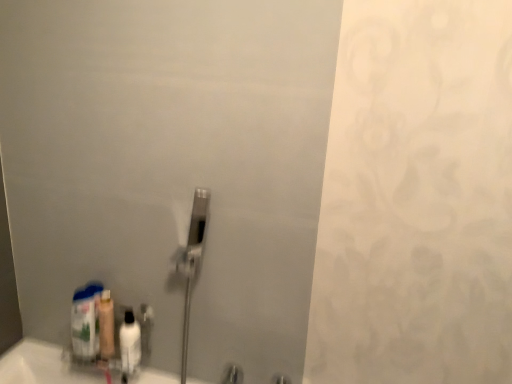
Measure the distance between point (x=112, y=313) and camera.

Point (x=112, y=313) and camera are 4.38 feet apart from each other.

Where is `translucent plastic bottle at lower left`? translucent plastic bottle at lower left is located at coordinates (86, 321).

You are a GUI agent. You are given a task and a screenshot of the screen. Output one action in this format:
    pyautogui.click(x=<x>, y=<y>)
    Task: Click on the translucent plastic mouthwash at lower left, which is the 1th mouthwash in left-to-right order
    
    Given the screenshot: What is the action you would take?
    pyautogui.click(x=106, y=325)

Is translucent plastic mouthwash at lower left, the second mouthwash positioned from the right, at the right side of white glossy bottle at lower left, the 2th mouthwash in the left-to-right sequence?

In fact, translucent plastic mouthwash at lower left, the second mouthwash positioned from the right, is to the left of white glossy bottle at lower left, the 2th mouthwash in the left-to-right sequence.

Does translucent plastic mouthwash at lower left, the second mouthwash positioned from the right, have a greater height compared to white glossy bottle at lower left, the 2th mouthwash in the left-to-right sequence?

Indeed, translucent plastic mouthwash at lower left, the second mouthwash positioned from the right, has a greater height compared to white glossy bottle at lower left, the 2th mouthwash in the left-to-right sequence.

How different are the orientations of translucent plastic mouthwash at lower left, the second mouthwash positioned from the right, and white glossy bottle at lower left, which is the first mouthwash from right to left, in degrees?

There is a 0.000488-degree angle between the facing directions of translucent plastic mouthwash at lower left, the second mouthwash positioned from the right, and white glossy bottle at lower left, which is the first mouthwash from right to left.

Is translucent plastic mouthwash at lower left, which is the 1th mouthwash in left-to-right order, oriented towards white glossy bottle at lower left, the 2th mouthwash in the left-to-right sequence?

No, translucent plastic mouthwash at lower left, which is the 1th mouthwash in left-to-right order, does not turn towards white glossy bottle at lower left, the 2th mouthwash in the left-to-right sequence.

Is point (83, 339) farther from viewer compared to point (105, 337)?

No, it is not.

In terms of width, does translucent plastic bottle at lower left look wider or thinner when compared to translucent plastic mouthwash at lower left, the second mouthwash positioned from the right?

Clearly, translucent plastic bottle at lower left has more width compared to translucent plastic mouthwash at lower left, the second mouthwash positioned from the right.

Is translucent plastic bottle at lower left not near translucent plastic mouthwash at lower left, the second mouthwash positioned from the right?

No, translucent plastic bottle at lower left is not far from translucent plastic mouthwash at lower left, the second mouthwash positioned from the right.

From a real-world perspective, between translucent plastic bottle at lower left and translucent plastic mouthwash at lower left, which is the 1th mouthwash in left-to-right order, who is vertically higher?

translucent plastic mouthwash at lower left, which is the 1th mouthwash in left-to-right order, from a real-world perspective.

Is white glossy bottle at lower left, the 2th mouthwash in the left-to-right sequence, completely or partially outside of translucent plastic bottle at lower left?

Yes, white glossy bottle at lower left, the 2th mouthwash in the left-to-right sequence, is outside of translucent plastic bottle at lower left.

Which of these two, white glossy bottle at lower left, the 2th mouthwash in the left-to-right sequence, or translucent plastic bottle at lower left, is bigger?

translucent plastic bottle at lower left.

Can you see white glossy bottle at lower left, which is the first mouthwash from right to left, touching translucent plastic bottle at lower left?

No, white glossy bottle at lower left, which is the first mouthwash from right to left, is not next to translucent plastic bottle at lower left.

From the image's perspective, which is below, translucent plastic bottle at lower left or white glossy bottle at lower left, which is the first mouthwash from right to left?

white glossy bottle at lower left, which is the first mouthwash from right to left.

Looking at this image, from a real-world perspective, which is physically below, translucent plastic bottle at lower left or white glossy bottle at lower left, the 2th mouthwash in the left-to-right sequence?

white glossy bottle at lower left, the 2th mouthwash in the left-to-right sequence.

Between translucent plastic bottle at lower left and white glossy bottle at lower left, the 2th mouthwash in the left-to-right sequence, which one has larger size?

With larger size is translucent plastic bottle at lower left.

Can translucent plastic bottle at lower left be found inside translucent plastic mouthwash at lower left, the second mouthwash positioned from the right?

Actually, translucent plastic bottle at lower left is outside translucent plastic mouthwash at lower left, the second mouthwash positioned from the right.

Considering the relative sizes of translucent plastic mouthwash at lower left, the second mouthwash positioned from the right, and translucent plastic bottle at lower left in the image provided, is translucent plastic mouthwash at lower left, the second mouthwash positioned from the right, taller than translucent plastic bottle at lower left?

No.

Is translucent plastic mouthwash at lower left, the second mouthwash positioned from the right, wider than translucent plastic bottle at lower left?

Incorrect, the width of translucent plastic mouthwash at lower left, the second mouthwash positioned from the right, does not surpass that of translucent plastic bottle at lower left.

Considering the positions of point (123, 363) and point (104, 337), is point (123, 363) closer or farther from the camera than point (104, 337)?

Point (123, 363) appears to be closer to the viewer than point (104, 337).

From a real-world perspective, is white glossy bottle at lower left, which is the first mouthwash from right to left, beneath translucent plastic mouthwash at lower left, the second mouthwash positioned from the right?

Indeed, from a real-world perspective, white glossy bottle at lower left, which is the first mouthwash from right to left, is positioned beneath translucent plastic mouthwash at lower left, the second mouthwash positioned from the right.

Considering the sizes of objects white glossy bottle at lower left, which is the first mouthwash from right to left, and translucent plastic mouthwash at lower left, the second mouthwash positioned from the right, in the image provided, who is shorter, white glossy bottle at lower left, which is the first mouthwash from right to left, or translucent plastic mouthwash at lower left, the second mouthwash positioned from the right,?

With less height is white glossy bottle at lower left, which is the first mouthwash from right to left.

Can you see white glossy bottle at lower left, which is the first mouthwash from right to left, touching translucent plastic mouthwash at lower left, which is the 1th mouthwash in left-to-right order?

Yes, white glossy bottle at lower left, which is the first mouthwash from right to left, is in contact with translucent plastic mouthwash at lower left, which is the 1th mouthwash in left-to-right order.

Where is `mouthwash directly beneath the translucent plastic mouthwash at lower left, the second mouthwash positioned from the right (from a real-world perspective)`? The width and height of the screenshot is (512, 384). mouthwash directly beneath the translucent plastic mouthwash at lower left, the second mouthwash positioned from the right (from a real-world perspective) is located at coordinates (129, 345).

Find the location of a particular element. This screenshot has height=384, width=512. cleaning product in front of the translucent plastic mouthwash at lower left, which is the 1th mouthwash in left-to-right order is located at coordinates (86, 321).

When comparing their distances from translucent plastic bottle at lower left, does white glossy bottle at lower left, the 2th mouthwash in the left-to-right sequence, or translucent plastic mouthwash at lower left, which is the 1th mouthwash in left-to-right order, seem closer?

translucent plastic mouthwash at lower left, which is the 1th mouthwash in left-to-right order, is closer to translucent plastic bottle at lower left.

Which object lies nearer to the anchor point translucent plastic mouthwash at lower left, which is the 1th mouthwash in left-to-right order, translucent plastic bottle at lower left or white glossy bottle at lower left, the 2th mouthwash in the left-to-right sequence?

The object closer to translucent plastic mouthwash at lower left, which is the 1th mouthwash in left-to-right order, is translucent plastic bottle at lower left.

Considering their positions, is translucent plastic mouthwash at lower left, the second mouthwash positioned from the right, positioned further to white glossy bottle at lower left, the 2th mouthwash in the left-to-right sequence, than translucent plastic bottle at lower left?

translucent plastic bottle at lower left lies further to white glossy bottle at lower left, the 2th mouthwash in the left-to-right sequence, than the other object.

Looking at the image, which one is located closer to translucent plastic mouthwash at lower left, the second mouthwash positioned from the right, white glossy bottle at lower left, which is the first mouthwash from right to left, or translucent plastic bottle at lower left?

translucent plastic bottle at lower left lies closer to translucent plastic mouthwash at lower left, the second mouthwash positioned from the right, than the other object.

Looking at the image, which one is located further to translucent plastic bottle at lower left, translucent plastic mouthwash at lower left, the second mouthwash positioned from the right, or white glossy bottle at lower left, which is the first mouthwash from right to left?

white glossy bottle at lower left, which is the first mouthwash from right to left, lies further to translucent plastic bottle at lower left than the other object.

Based on their spatial positions, is translucent plastic bottle at lower left or translucent plastic mouthwash at lower left, which is the 1th mouthwash in left-to-right order, closer to white glossy bottle at lower left, the 2th mouthwash in the left-to-right sequence?

translucent plastic mouthwash at lower left, which is the 1th mouthwash in left-to-right order, is positioned closer to the anchor white glossy bottle at lower left, the 2th mouthwash in the left-to-right sequence.

You are a GUI agent. You are given a task and a screenshot of the screen. Output one action in this format:
    pyautogui.click(x=<x>, y=<y>)
    Task: Click on the mouthwash situated between translucent plastic bottle at lower left and white glossy bottle at lower left, the 2th mouthwash in the left-to-right sequence, from left to right
    The image size is (512, 384).
    Given the screenshot: What is the action you would take?
    pyautogui.click(x=106, y=325)